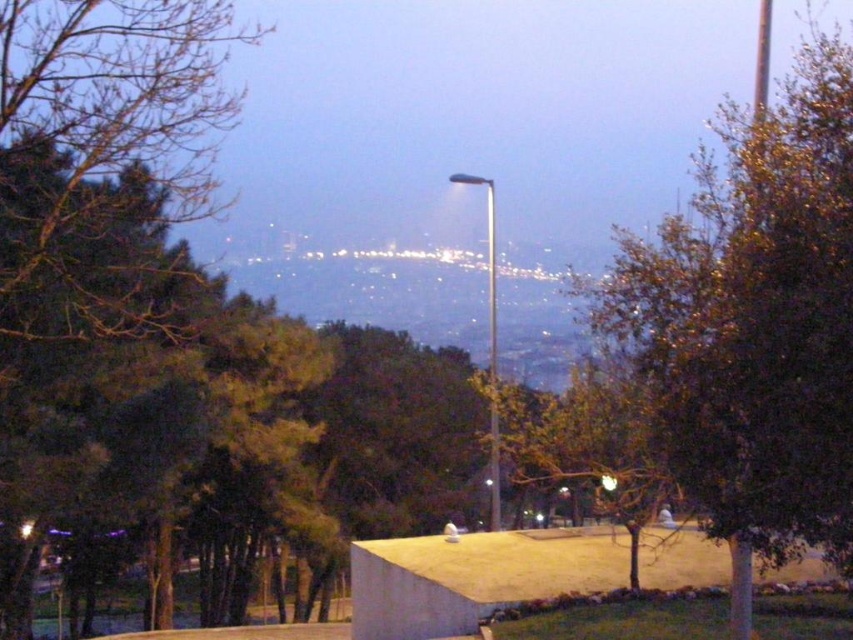
Is green leafy tree at center shorter than silver metallic street light at center?

Incorrect, green leafy tree at center's height does not fall short of silver metallic street light at center's.

Does green leafy tree at center appear under silver metallic street light at center?

Actually, green leafy tree at center is above silver metallic street light at center.

Describe the element at coordinates (756, 321) in the screenshot. I see `green leafy tree at center` at that location.

Where is `green leafy tree at center`? Image resolution: width=853 pixels, height=640 pixels. green leafy tree at center is located at coordinates (756, 321).